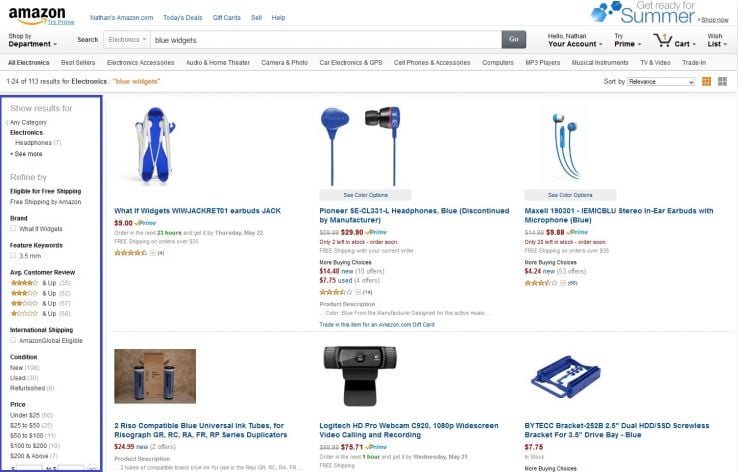
Identify the location of black webcam. This screenshot has height=472, width=738. (353, 379).